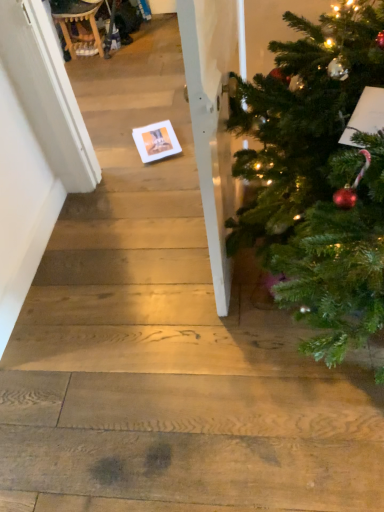
Image resolution: width=384 pixels, height=512 pixels. What do you see at coordinates (156, 141) in the screenshot?
I see `white matte card at center` at bounding box center [156, 141].

Locate an element on the screen. The height and width of the screenshot is (512, 384). white matte card at center is located at coordinates (156, 141).

Where is `wooden rocking chair at upper left`? The height and width of the screenshot is (512, 384). wooden rocking chair at upper left is located at coordinates (78, 26).

This screenshot has width=384, height=512. Describe the element at coordinates (78, 26) in the screenshot. I see `wooden rocking chair at upper left` at that location.

Where is `white matte card at center`? white matte card at center is located at coordinates (156, 141).

In the image, is white matte card at center on the left side or the right side of wooden rocking chair at upper left?

Clearly, white matte card at center is on the right of wooden rocking chair at upper left in the image.

Considering the relative positions of white matte card at center and wooden rocking chair at upper left in the image provided, is white matte card at center behind wooden rocking chair at upper left?

No, it is not.

Considering the points (139, 136) and (73, 5), which point is behind, point (139, 136) or point (73, 5)?

The point (73, 5) is farther from the camera.

From the image's perspective, would you say white matte card at center is positioned over wooden rocking chair at upper left?

No, from the image's perspective, white matte card at center is not above wooden rocking chair at upper left.

From a real-world perspective, does white matte card at center sit lower than wooden rocking chair at upper left?

Yes, from a real-world perspective, white matte card at center is beneath wooden rocking chair at upper left.

Considering the sizes of white matte card at center and wooden rocking chair at upper left in the image, is white matte card at center wider or thinner than wooden rocking chair at upper left?

Clearly, white matte card at center has more width compared to wooden rocking chair at upper left.

In terms of height, does white matte card at center look taller or shorter compared to wooden rocking chair at upper left?

In the image, white matte card at center appears to be shorter than wooden rocking chair at upper left.

Considering the sizes of white matte card at center and wooden rocking chair at upper left in the image, is white matte card at center bigger or smaller than wooden rocking chair at upper left?

white matte card at center is smaller than wooden rocking chair at upper left.

Choose the correct answer: Is white matte card at center inside wooden rocking chair at upper left or outside it?

white matte card at center is located beyond the bounds of wooden rocking chair at upper left.

Are white matte card at center and wooden rocking chair at upper left far apart?

Yes, white matte card at center is far from wooden rocking chair at upper left.

Is wooden rocking chair at upper left at the back of white matte card at center?

No, white matte card at center is not facing away from wooden rocking chair at upper left.

Can you tell me how much white matte card at center and wooden rocking chair at upper left differ in facing direction?

white matte card at center and wooden rocking chair at upper left are facing 111 degrees away from each other.

Find the location of `rocking chair on the left of white matte card at center`. rocking chair on the left of white matte card at center is located at coordinates (78, 26).

Which is more to the right, wooden rocking chair at upper left or white matte card at center?

white matte card at center.

Which object is more forward, wooden rocking chair at upper left or white matte card at center?

white matte card at center.

Which is behind, point (71, 42) or point (180, 147)?

Point (71, 42)

From the image's perspective, between wooden rocking chair at upper left and white matte card at center, who is located below?

white matte card at center is shown below in the image.

From a real-world perspective, is wooden rocking chair at upper left positioned under white matte card at center based on gravity?

No, from a real-world perspective, wooden rocking chair at upper left is not below white matte card at center.

Looking at their sizes, would you say wooden rocking chair at upper left is wider or thinner than white matte card at center?

In the image, wooden rocking chair at upper left appears to be more narrow than white matte card at center.

Does wooden rocking chair at upper left have a greater height compared to white matte card at center?

Yes.

Does wooden rocking chair at upper left have a smaller size compared to white matte card at center?

Actually, wooden rocking chair at upper left might be larger than white matte card at center.

Would you say white matte card at center is part of wooden rocking chair at upper left's contents?

No, white matte card at center is not surrounded by wooden rocking chair at upper left.

Is wooden rocking chair at upper left in contact with white matte card at center?

wooden rocking chair at upper left and white matte card at center are clearly separated.

Is white matte card at center at the back of wooden rocking chair at upper left?

No, white matte card at center is not at the back of wooden rocking chair at upper left.

What's the angular difference between wooden rocking chair at upper left and white matte card at center's facing directions?

The angular difference between wooden rocking chair at upper left and white matte card at center is 111 degrees.

Locate an element on the screen. Image resolution: width=384 pixels, height=512 pixels. rocking chair that appears on the left of white matte card at center is located at coordinates (78, 26).

At what (x,y) coordinates should I click in order to perform the action: click on rocking chair on the left of white matte card at center. Please return your answer as a coordinate pair (x, y). This screenshot has width=384, height=512. Looking at the image, I should click on (78, 26).

I want to click on rocking chair above the white matte card at center (from the image's perspective), so click(x=78, y=26).